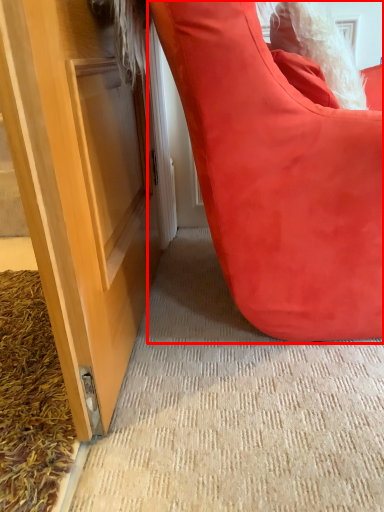
Question: From the image's perspective, considering the relative positions of furniture (annotated by the red box) and doormat in the image provided, where is furniture (annotated by the red box) located with respect to the staircase?

Choices:
 (A) above
 (B) below

Answer: (A)